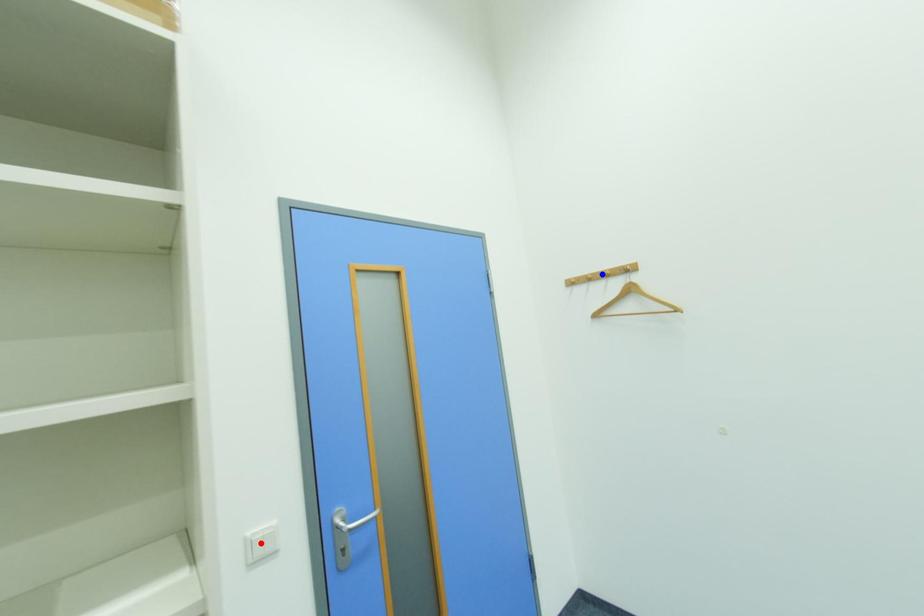
Question: Which of the two points in the image is closer to the camera?

Choices:
 (A) Blue point is closer.
 (B) Red point is closer.

Answer: (B)